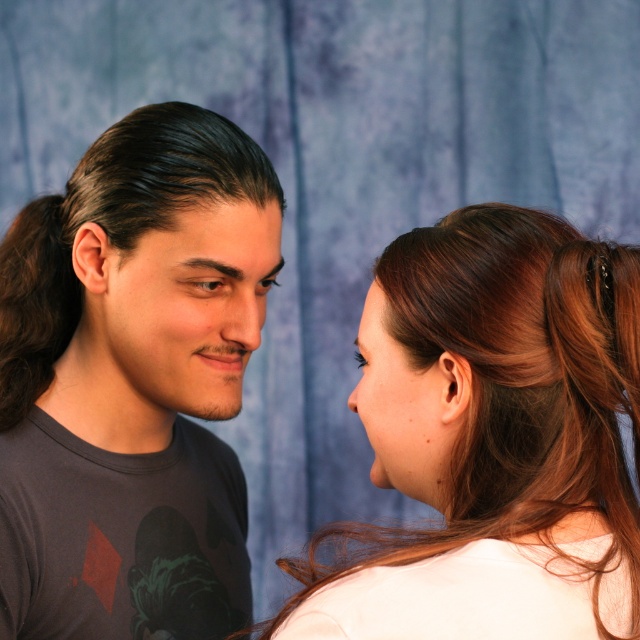
You are a photographer setting up a photo shoot with two people. You need to position them so that the person with brown hair at upper right can be seen clearly over the person with smooth skin at center. Based on the scene description, is this possible? Explain why or why not.

The brown hair at upper right is much taller as smooth skin at center, so yes, the person with brown hair at upper right can be positioned to be seen clearly over the person with smooth skin at center because their height difference allows the taller individual to be visible over the shorter one.

You are a photographer trying to capture a closeup shot of the smooth skin at center without including the brown hair at upper right in the frame. Based on their positions, is this possible?

The brown hair at upper right is positioned on the right side of smooth skin at center, so it is possible to frame the shot to exclude the brown hair by adjusting the camera angle to focus solely on the smooth skin at center.